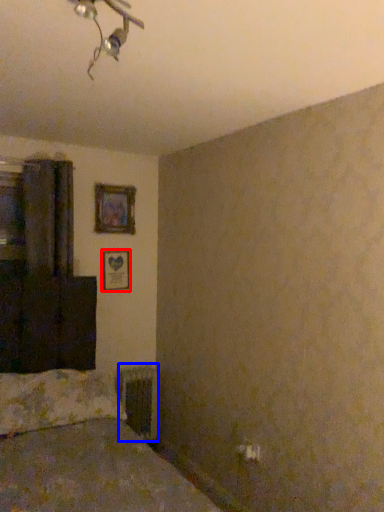
Question: Which of the following is the farthest to the observer, picture frame (highlighted by a red box) or radiator (highlighted by a blue box)?

Choices:
 (A) picture frame
 (B) radiator

Answer: (A)